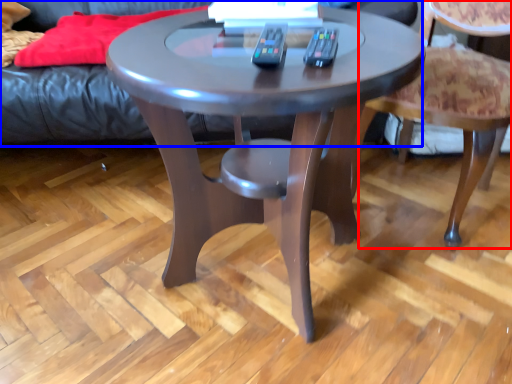
Question: Among these objects, which one is nearest to the camera, chair (highlighted by a red box) or couch (highlighted by a blue box)?

Choices:
 (A) chair
 (B) couch

Answer: (A)